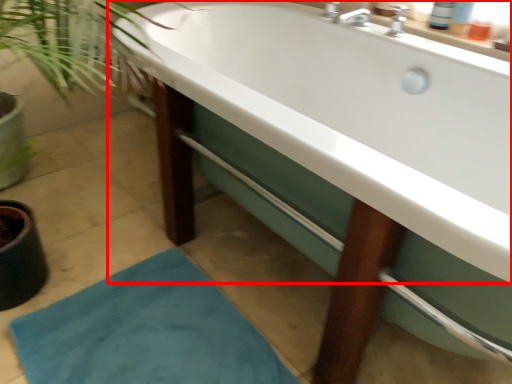
Question: In this image, where is bathtub (annotated by the red box) located relative to bath mat?

Choices:
 (A) right
 (B) left

Answer: (A)